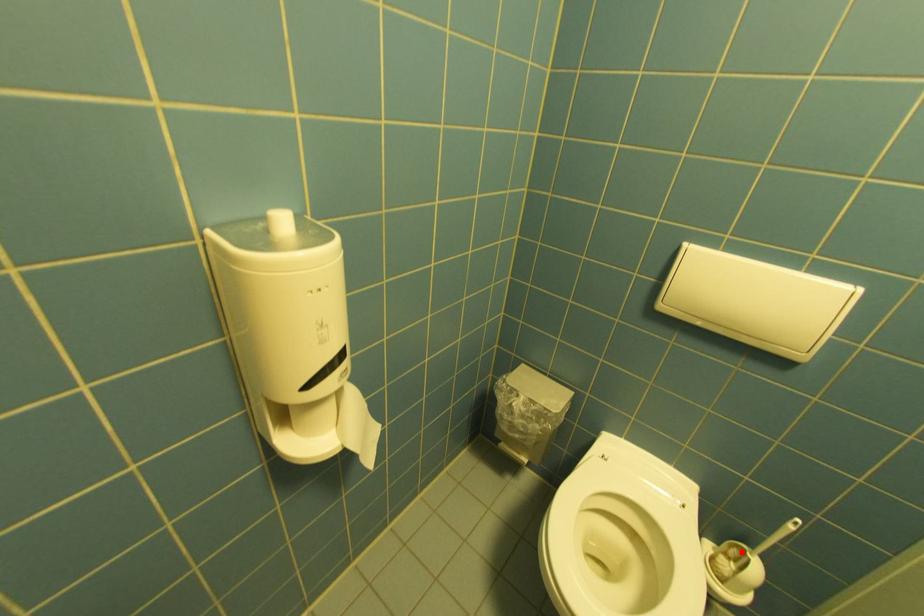
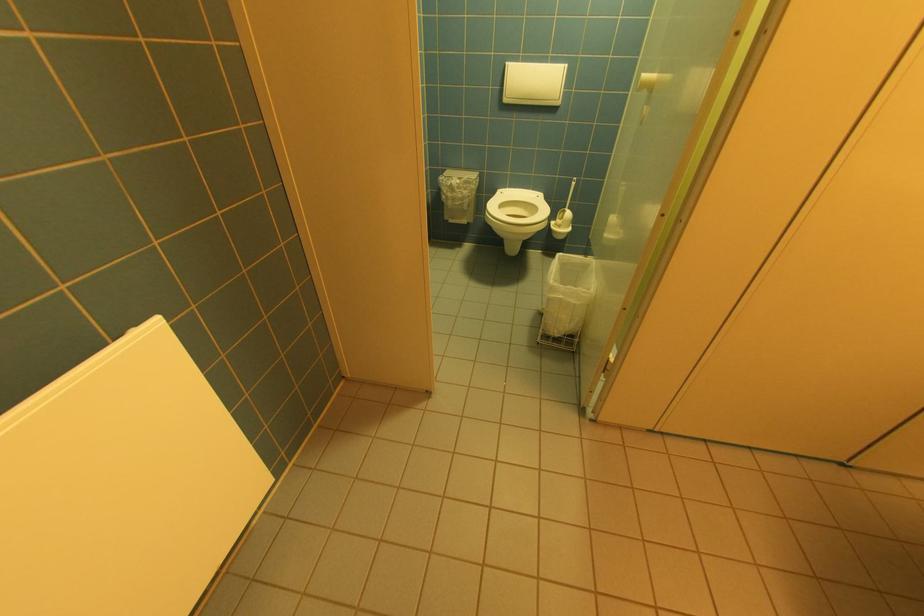
Find the pixel in the second image that matches the highlighted location in the first image.

(567, 215)